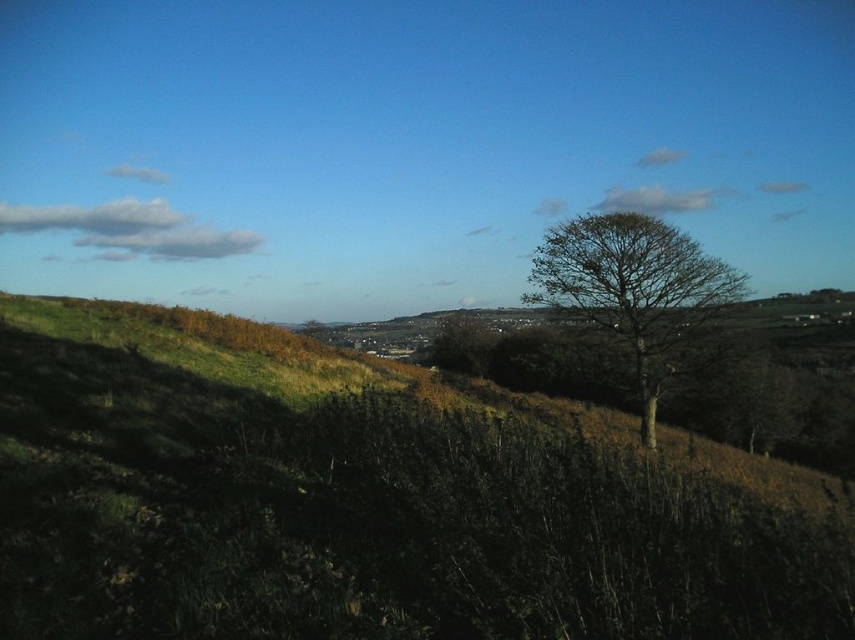
Between point (42, 365) and point (693, 337), which one is positioned behind?

Point (693, 337)

Who is lower down, green grassy hillside at center or bare wood tree at right?

green grassy hillside at center is below.

The height and width of the screenshot is (640, 855). Find the location of `green grassy hillside at center`. green grassy hillside at center is located at coordinates (372, 500).